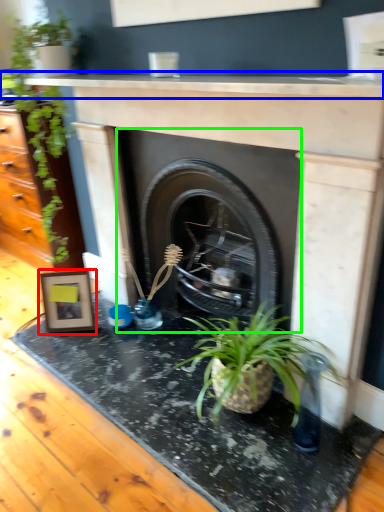
Question: Based on their relative distances, which object is farther from picture frame (highlighted by a red box)? Choose from counter top (highlighted by a blue box) and fireplace (highlighted by a green box).

Choices:
 (A) counter top
 (B) fireplace

Answer: (A)